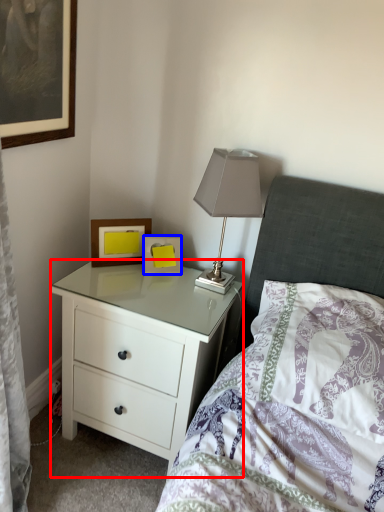
Question: Which point is further to the camera, chest of drawers (highlighted by a red box) or picture frame (highlighted by a blue box)?

Choices:
 (A) chest of drawers
 (B) picture frame

Answer: (B)